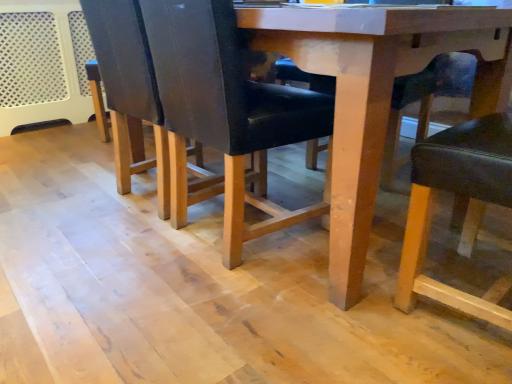
What do you see at coordinates (465, 196) in the screenshot?
I see `matte black chair at lower right, which ranks as the 1th chair in front-to-back order` at bounding box center [465, 196].

In order to click on matte black chair at lower right, which is the second chair from back to front in this screenshot , I will do `click(465, 196)`.

Measure the distance between point (x=414, y=293) and camera.

3.80 feet.

What do you see at coordinates (401, 113) in the screenshot?
I see `wooden chair leg at center, the second chair positioned from the front` at bounding box center [401, 113].

This screenshot has width=512, height=384. Find the location of `wooden chair leg at center, the first chair in the back-to-front sequence`. wooden chair leg at center, the first chair in the back-to-front sequence is located at coordinates (401, 113).

You are a GUI agent. You are given a task and a screenshot of the screen. Output one action in this format:
    pyautogui.click(x=<x>, y=<y>)
    Task: Click on the matte black chair at lower right, which is the second chair from back to front
    The height and width of the screenshot is (384, 512).
    Given the screenshot: What is the action you would take?
    pyautogui.click(x=465, y=196)

Visually, is matte black chair at lower right, which ranks as the 1th chair in front-to-back order, positioned to the left or to the right of wooden chair leg at center, the first chair in the back-to-front sequence?

In the image, matte black chair at lower right, which ranks as the 1th chair in front-to-back order, appears on the right side of wooden chair leg at center, the first chair in the back-to-front sequence.

Is matte black chair at lower right, which is the second chair from back to front, behind wooden chair leg at center, the second chair positioned from the front?

No, matte black chair at lower right, which is the second chair from back to front, is closer to the camera.

Is point (416, 241) closer or farther from the camera than point (305, 82)?

Point (416, 241) is closer to the camera than point (305, 82).

From the image's perspective, is matte black chair at lower right, which ranks as the 1th chair in front-to-back order, positioned above or below wooden chair leg at center, the second chair positioned from the front?

Based on their image positions, matte black chair at lower right, which ranks as the 1th chair in front-to-back order, is located beneath wooden chair leg at center, the second chair positioned from the front.

From a real-world perspective, is matte black chair at lower right, which ranks as the 1th chair in front-to-back order, positioned over wooden chair leg at center, the second chair positioned from the front, based on gravity?

Actually, matte black chair at lower right, which ranks as the 1th chair in front-to-back order, is physically below wooden chair leg at center, the second chair positioned from the front, in the real world.

Does matte black chair at lower right, which is the second chair from back to front, have a greater width compared to wooden chair leg at center, the second chair positioned from the front?

In fact, matte black chair at lower right, which is the second chair from back to front, might be narrower than wooden chair leg at center, the second chair positioned from the front.

Considering the relative sizes of matte black chair at lower right, which is the second chair from back to front, and wooden chair leg at center, the first chair in the back-to-front sequence, in the image provided, is matte black chair at lower right, which is the second chair from back to front, shorter than wooden chair leg at center, the first chair in the back-to-front sequence,?

Incorrect, the height of matte black chair at lower right, which is the second chair from back to front, does not fall short of that of wooden chair leg at center, the first chair in the back-to-front sequence.

Who is bigger, matte black chair at lower right, which ranks as the 1th chair in front-to-back order, or wooden chair leg at center, the second chair positioned from the front?

wooden chair leg at center, the second chair positioned from the front.

Would you say matte black chair at lower right, which is the second chair from back to front, contains wooden chair leg at center, the second chair positioned from the front?

That's incorrect, wooden chair leg at center, the second chair positioned from the front, is not inside matte black chair at lower right, which is the second chair from back to front.

Is there a large distance between matte black chair at lower right, which is the second chair from back to front, and wooden chair leg at center, the second chair positioned from the front?

No, there isn't a large distance between matte black chair at lower right, which is the second chair from back to front, and wooden chair leg at center, the second chair positioned from the front.

Is matte black chair at lower right, which ranks as the 1th chair in front-to-back order, oriented towards wooden chair leg at center, the second chair positioned from the front?

No, matte black chair at lower right, which ranks as the 1th chair in front-to-back order, does not turn towards wooden chair leg at center, the second chair positioned from the front.

How different are the orientations of matte black chair at lower right, which ranks as the 1th chair in front-to-back order, and wooden chair leg at center, the first chair in the back-to-front sequence, in degrees?

95.7 degrees separate the facing orientations of matte black chair at lower right, which ranks as the 1th chair in front-to-back order, and wooden chair leg at center, the first chair in the back-to-front sequence.

Image resolution: width=512 pixels, height=384 pixels. I want to click on chair below the wooden chair leg at center, the first chair in the back-to-front sequence (from the image's perspective), so click(x=465, y=196).

Can you confirm if wooden chair leg at center, the second chair positioned from the front, is positioned to the right of matte black chair at lower right, which ranks as the 1th chair in front-to-back order?

Incorrect, wooden chair leg at center, the second chair positioned from the front, is not on the right side of matte black chair at lower right, which ranks as the 1th chair in front-to-back order.

Which is behind, wooden chair leg at center, the first chair in the back-to-front sequence, or matte black chair at lower right, which is the second chair from back to front?

wooden chair leg at center, the first chair in the back-to-front sequence, is further from the camera.

Which is in front, point (422, 127) or point (470, 180)?

The point (470, 180) is closer to the camera.

From the image's perspective, is wooden chair leg at center, the first chair in the back-to-front sequence, located above or below matte black chair at lower right, which is the second chair from back to front?

Clearly, from the image's perspective, wooden chair leg at center, the first chair in the back-to-front sequence, is above matte black chair at lower right, which is the second chair from back to front.

From a real-world perspective, relative to matte black chair at lower right, which is the second chair from back to front, is wooden chair leg at center, the first chair in the back-to-front sequence, vertically above or below?

wooden chair leg at center, the first chair in the back-to-front sequence, is situated higher than matte black chair at lower right, which is the second chair from back to front, in the real world.

Based on the photo, does wooden chair leg at center, the second chair positioned from the front, have a greater width compared to matte black chair at lower right, which ranks as the 1th chair in front-to-back order?

Yes.

Considering the relative sizes of wooden chair leg at center, the first chair in the back-to-front sequence, and matte black chair at lower right, which is the second chair from back to front, in the image provided, is wooden chair leg at center, the first chair in the back-to-front sequence, taller than matte black chair at lower right, which is the second chair from back to front,?

No.

Considering the relative sizes of wooden chair leg at center, the second chair positioned from the front, and matte black chair at lower right, which is the second chair from back to front, in the image provided, is wooden chair leg at center, the second chair positioned from the front, bigger than matte black chair at lower right, which is the second chair from back to front,?

Indeed, wooden chair leg at center, the second chair positioned from the front, has a larger size compared to matte black chair at lower right, which is the second chair from back to front.

Could matte black chair at lower right, which ranks as the 1th chair in front-to-back order, be considered to be inside wooden chair leg at center, the first chair in the back-to-front sequence?

No, matte black chair at lower right, which ranks as the 1th chair in front-to-back order, is located outside of wooden chair leg at center, the first chair in the back-to-front sequence.

Is wooden chair leg at center, the second chair positioned from the front, touching matte black chair at lower right, which ranks as the 1th chair in front-to-back order?

wooden chair leg at center, the second chair positioned from the front, is not next to matte black chair at lower right, which ranks as the 1th chair in front-to-back order, and they're not touching.

Is wooden chair leg at center, the second chair positioned from the front, oriented away from matte black chair at lower right, which is the second chair from back to front?

No, wooden chair leg at center, the second chair positioned from the front, is not facing the opposite direction of matte black chair at lower right, which is the second chair from back to front.

What's the angular difference between wooden chair leg at center, the first chair in the back-to-front sequence, and matte black chair at lower right, which ranks as the 1th chair in front-to-back order,'s facing directions?

The angle between the facing direction of wooden chair leg at center, the first chair in the back-to-front sequence, and the facing direction of matte black chair at lower right, which ranks as the 1th chair in front-to-back order, is 95.7 degrees.

This screenshot has height=384, width=512. What are the coordinates of `chair in front of the wooden chair leg at center, the first chair in the back-to-front sequence` in the screenshot? It's located at (465, 196).

At what (x,y) coordinates should I click in order to perform the action: click on chair located underneath the wooden chair leg at center, the first chair in the back-to-front sequence (from a real-world perspective). Please return your answer as a coordinate pair (x, y). Looking at the image, I should click on (465, 196).

In order to click on chair that appears above the matte black chair at lower right, which ranks as the 1th chair in front-to-back order (from the image's perspective) in this screenshot , I will do `click(401, 113)`.